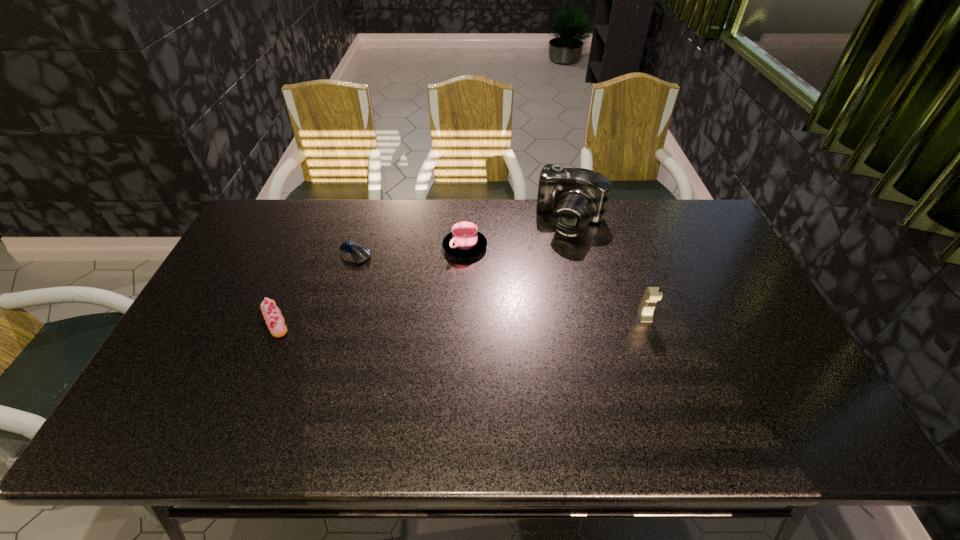
Locate an element on the screen. The height and width of the screenshot is (540, 960). free region located on the side with the handle of the third object from left to right is located at coordinates (433, 295).

You are a GUI agent. You are given a task and a screenshot of the screen. Output one action in this format:
    pyautogui.click(x=<x>, y=<y>)
    Task: Click on the vacant space located 0.310m on the side with the handle of the third object from left to right
    
    Given the screenshot: What is the action you would take?
    pyautogui.click(x=407, y=333)

Locate an element on the screen. vacant region located 0.130m on the side with the handle of the third object from left to right is located at coordinates (437, 288).

Where is `free spot located on the lens of the fourth object from left to right`? The image size is (960, 540). free spot located on the lens of the fourth object from left to right is located at coordinates (553, 254).

Where is `free location located 0.240m on the lens of the fourth object from left to right`? This screenshot has width=960, height=540. free location located 0.240m on the lens of the fourth object from left to right is located at coordinates (533, 288).

At what (x,y) coordinates should I click in order to perform the action: click on vacant area situated 0.310m on the lens of the fourth object from left to right. Please return your answer as a coordinate pair (x, y). Looking at the image, I should click on (523, 304).

Image resolution: width=960 pixels, height=540 pixels. I want to click on vacant point located on the button side of the computer mouse, so click(408, 289).

The image size is (960, 540). Identify the location of vacant space situated 0.120m on the button side of the computer mouse. (392, 279).

Where is `vacant space located on the button side of the computer mouse`? The width and height of the screenshot is (960, 540). vacant space located on the button side of the computer mouse is located at coordinates (427, 302).

Where is `cup at the far edge`? cup at the far edge is located at coordinates pyautogui.click(x=464, y=241).